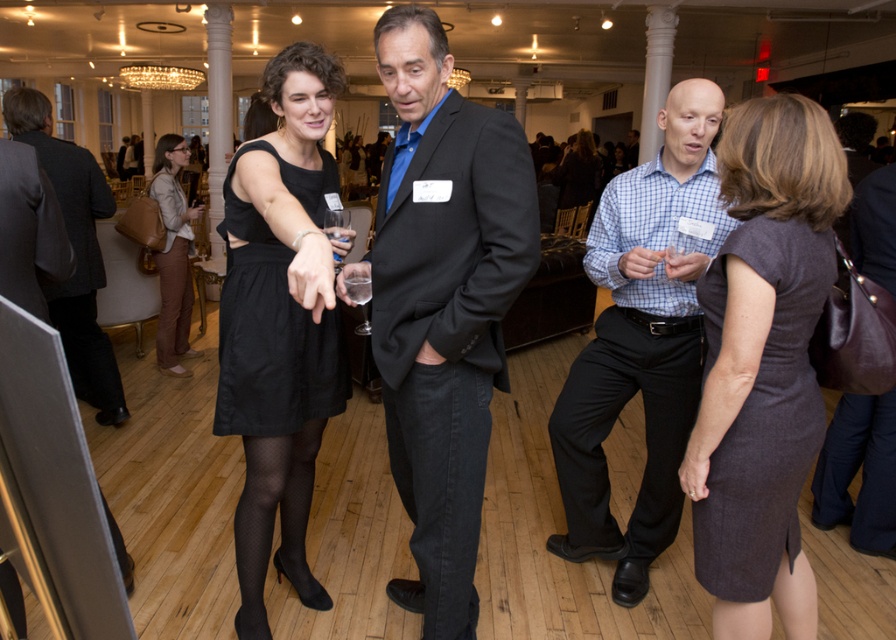
Can you confirm if matte black suit at center is positioned above dark gray wool suit at center?

Actually, matte black suit at center is below dark gray wool suit at center.

Does matte black suit at center appear on the left side of dark gray wool suit at center?

No, matte black suit at center is not to the left of dark gray wool suit at center.

Image resolution: width=896 pixels, height=640 pixels. Describe the element at coordinates (444, 304) in the screenshot. I see `matte black suit at center` at that location.

At what (x,y) coordinates should I click in order to perform the action: click on matte black suit at center. Please return your answer as a coordinate pair (x, y). Image resolution: width=896 pixels, height=640 pixels. Looking at the image, I should click on point(444,304).

Does matte black suit at center have a lesser height compared to black satin dress at center?

No.

Who is more forward, (475, 106) or (326, 333)?

Point (475, 106)

Where is `matte black suit at center`? The height and width of the screenshot is (640, 896). matte black suit at center is located at coordinates (444, 304).

Looking at this image, between matte black suit at center and black matte dress at center, which one has less height?

black matte dress at center

Based on the photo, is matte black suit at center thinner than black matte dress at center?

No, matte black suit at center is not thinner than black matte dress at center.

Between point (452, 186) and point (248, 400), which one is positioned in front?

Positioned in front is point (452, 186).

The width and height of the screenshot is (896, 640). What are the coordinates of `matte black suit at center` in the screenshot? It's located at (444, 304).